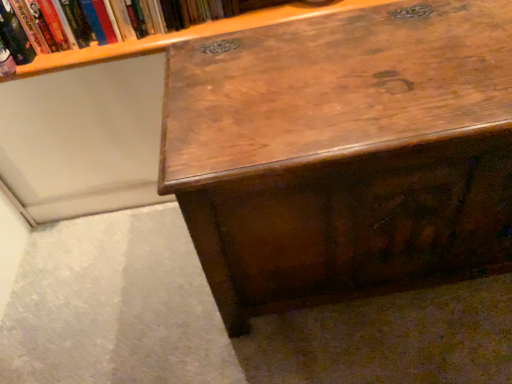
Question: Is shiny brown wood desk at center completely or partially inside hardcover book at upper left?

Choices:
 (A) no
 (B) yes

Answer: (A)

Question: Does hardcover book at upper left lie behind shiny brown wood desk at center?

Choices:
 (A) no
 (B) yes

Answer: (B)

Question: Does hardcover book at upper left turn towards shiny brown wood desk at center?

Choices:
 (A) no
 (B) yes

Answer: (A)

Question: Is hardcover book at upper left outside shiny brown wood desk at center?

Choices:
 (A) yes
 (B) no

Answer: (A)

Question: Considering the relative sizes of hardcover book at upper left and shiny brown wood desk at center in the image provided, is hardcover book at upper left wider than shiny brown wood desk at center?

Choices:
 (A) no
 (B) yes

Answer: (A)

Question: From a real-world perspective, is hardcover book at upper left under shiny brown wood desk at center?

Choices:
 (A) yes
 (B) no

Answer: (B)

Question: Does shiny brown wood desk at center turn towards hardcover book at upper left?

Choices:
 (A) yes
 (B) no

Answer: (B)

Question: Can you confirm if shiny brown wood desk at center is bigger than hardcover book at upper left?

Choices:
 (A) no
 (B) yes

Answer: (B)

Question: From a real-world perspective, is shiny brown wood desk at center on hardcover book at upper left?

Choices:
 (A) no
 (B) yes

Answer: (A)

Question: Does shiny brown wood desk at center appear on the right side of hardcover book at upper left?

Choices:
 (A) yes
 (B) no

Answer: (A)

Question: Is shiny brown wood desk at center positioned behind hardcover book at upper left?

Choices:
 (A) no
 (B) yes

Answer: (A)

Question: Does shiny brown wood desk at center have a lesser height compared to hardcover book at upper left?

Choices:
 (A) no
 (B) yes

Answer: (A)

Question: Is point (192, 18) closer or farther from the camera than point (318, 246)?

Choices:
 (A) closer
 (B) farther

Answer: (B)